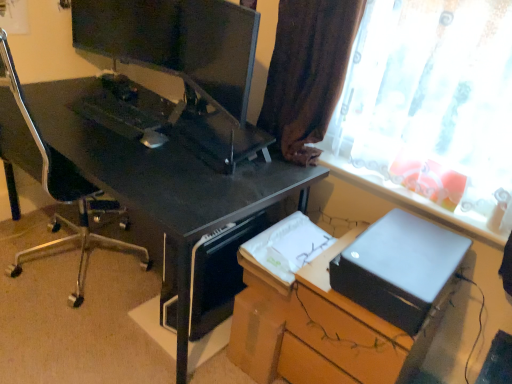
Image resolution: width=512 pixels, height=384 pixels. I want to click on free region under black glossy desk at center (from a real-world perspective), so click(x=99, y=254).